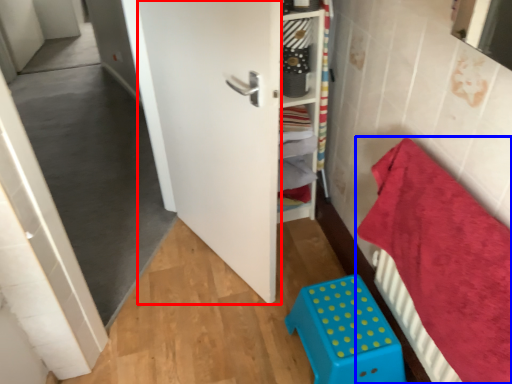
Question: Among these objects, which one is nearest to the camera, door (highlighted by a red box) or bedding (highlighted by a blue box)?

Choices:
 (A) door
 (B) bedding

Answer: (B)